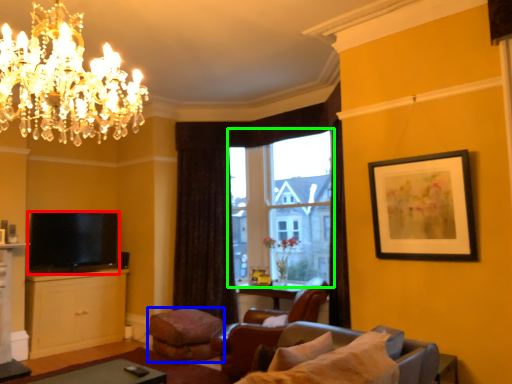
Question: Which is nearer to the television (highlighted by a red box)? footrest (highlighted by a blue box) or window (highlighted by a green box).

Choices:
 (A) footrest
 (B) window

Answer: (A)